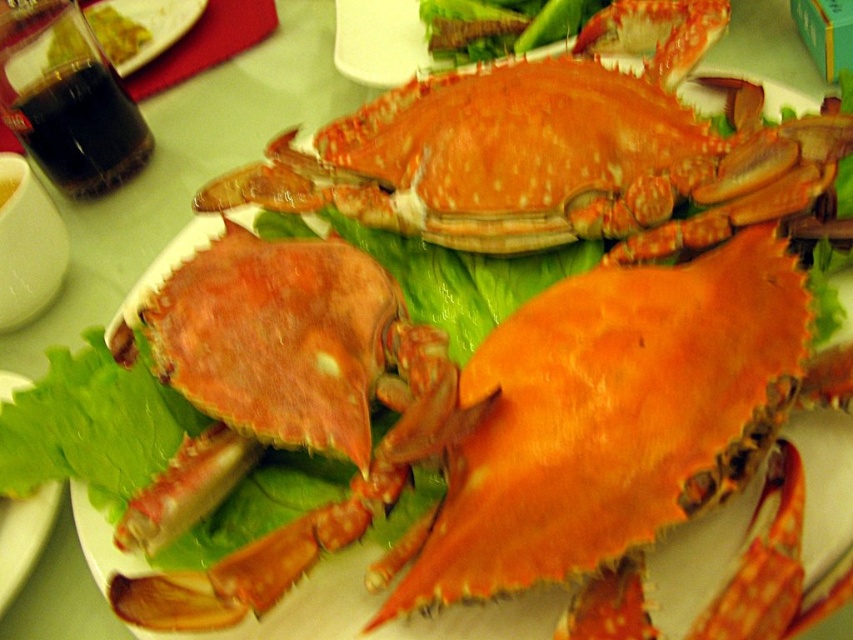
Who is more forward, (701, 364) or (51, 518)?

Point (701, 364) is more forward.

Is orange matte crab at center thinner than green leafy lettuce at lower left?

Incorrect, orange matte crab at center's width is not less than green leafy lettuce at lower left's.

In order to click on orange matte crab at center in this screenshot , I will do `click(608, 428)`.

What do you see at coordinates (22, 538) in the screenshot? I see `green leafy lettuce at lower left` at bounding box center [22, 538].

Which is more to the right, green leafy lettuce at lower left or yellow-green sauce at upper left?

Positioned to the right is green leafy lettuce at lower left.

Does point (10, 374) come farther from viewer compared to point (96, 8)?

No, (10, 374) is closer to viewer.

The height and width of the screenshot is (640, 853). What are the coordinates of `green leafy lettuce at lower left` in the screenshot? It's located at (22, 538).

Does shiny orange crab at center appear on the right side of yellow-green sauce at upper left?

Yes, shiny orange crab at center is to the right of yellow-green sauce at upper left.

Does shiny orange crab at center have a lesser height compared to yellow-green sauce at upper left?

No.

Between point (602, 176) and point (106, 28), which one is positioned in front?

Point (602, 176) is more forward.

Identify the location of shiny orange crab at center. (558, 148).